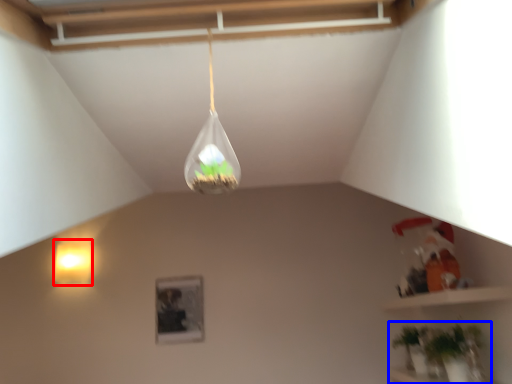
Question: Which point is closer to the camera, lamp (highlighted by a red box) or houseplant (highlighted by a blue box)?

Choices:
 (A) lamp
 (B) houseplant

Answer: (B)